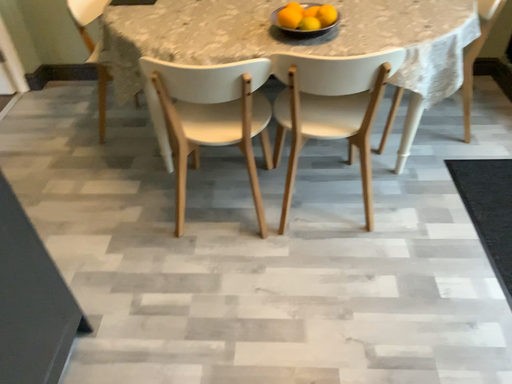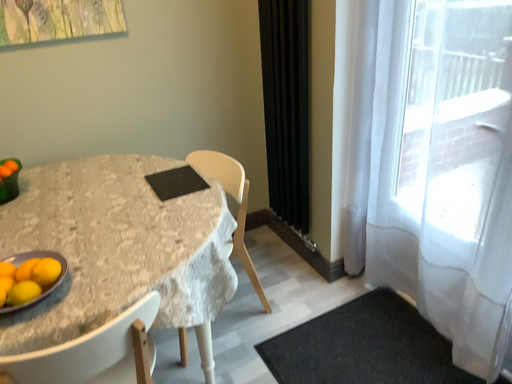
Question: How did the camera likely rotate when shooting the video?

Choices:
 (A) rotated right
 (B) rotated left

Answer: (A)